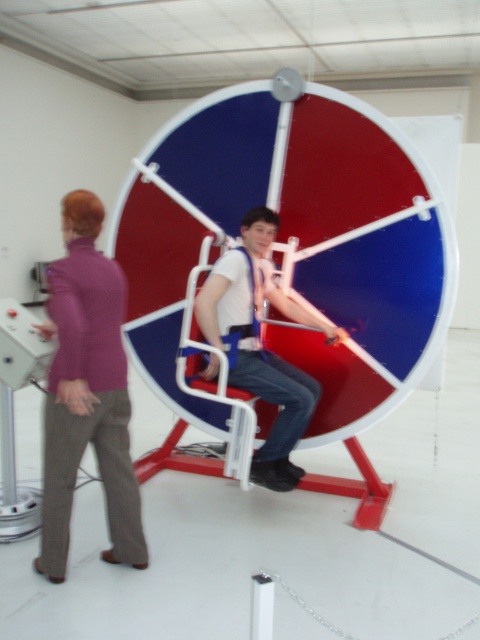
Can you confirm if matte purple shirt at left is bigger than white fabric harness at center?

Actually, matte purple shirt at left might be smaller than white fabric harness at center.

Find the location of a particular element. Image resolution: width=480 pixels, height=640 pixels. matte purple shirt at left is located at coordinates (86, 392).